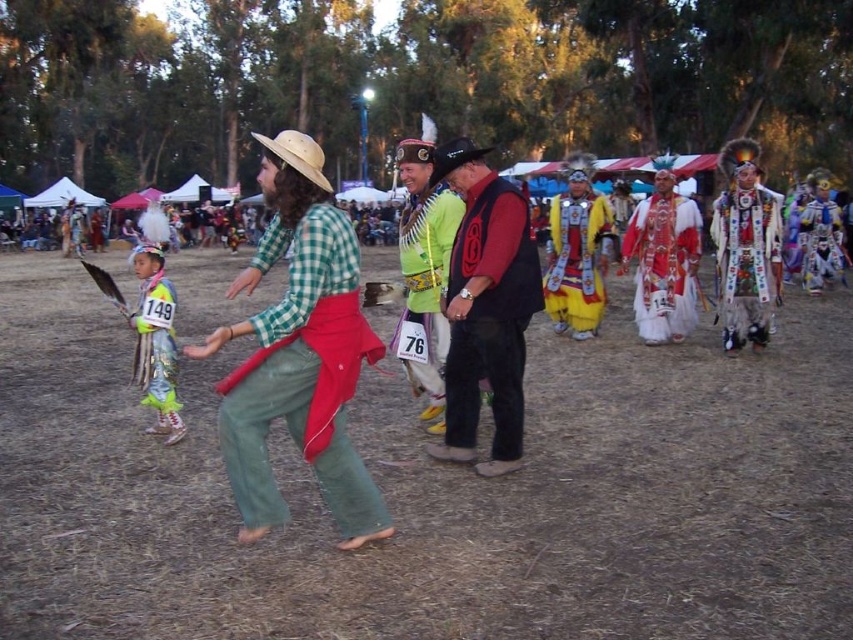
Which is more to the right, white and red fabric costume at right or multicolored fabric headdress at center?

white and red fabric costume at right

Does white and red fabric costume at right appear under multicolored fabric headdress at center?

Actually, white and red fabric costume at right is above multicolored fabric headdress at center.

Between point (660, 195) and point (434, 264), which one is positioned behind?

Point (660, 195)

The image size is (853, 640). What are the coordinates of `white and red fabric costume at right` in the screenshot? It's located at (663, 264).

Image resolution: width=853 pixels, height=640 pixels. Describe the element at coordinates (747, 259) in the screenshot. I see `embroidered velvet robe at right` at that location.

Which is in front, point (753, 280) or point (421, 241)?

Point (421, 241) is in front.

Find the location of a particular element. The image size is (853, 640). embroidered velvet robe at right is located at coordinates (747, 259).

Is green plaid shirt at center closer to the viewer compared to yellow satin regalia at center?

Yes, it is.

Who is more distant from viewer, (320,248) or (599,316)?

Positioned behind is point (599,316).

Identify the location of green plaid shirt at center. The width and height of the screenshot is (853, 640). [x=302, y=376].